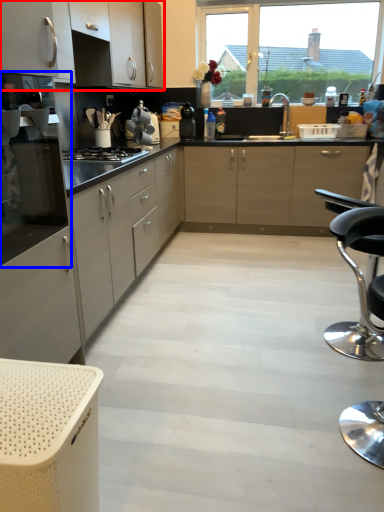
Question: Which object is closer to the camera taking this photo, cabinetry (highlighted by a red box) or oven (highlighted by a blue box)?

Choices:
 (A) cabinetry
 (B) oven

Answer: (B)